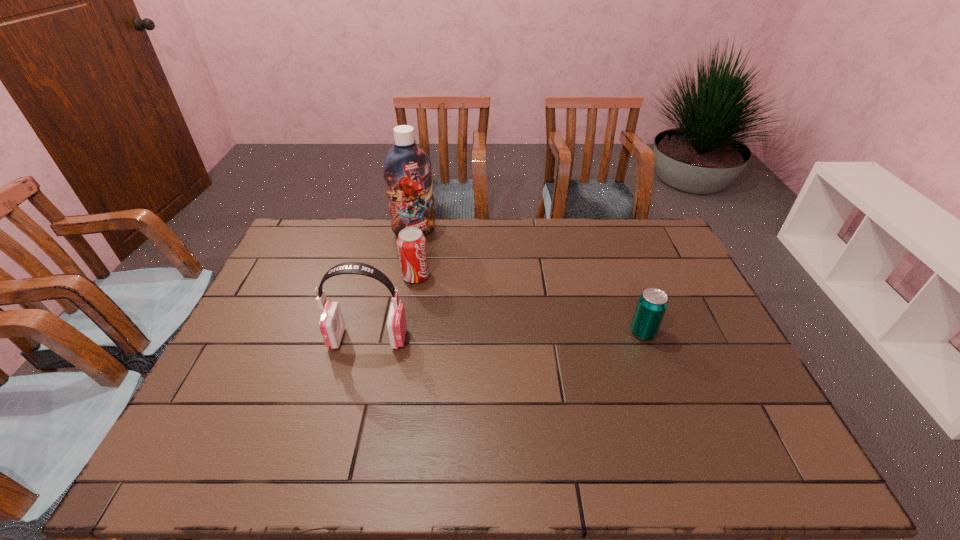
Where is `vacant area situated on the left of the beer can`? Image resolution: width=960 pixels, height=540 pixels. vacant area situated on the left of the beer can is located at coordinates (500, 333).

Image resolution: width=960 pixels, height=540 pixels. In order to click on free space located on the front label of the farthest object in this screenshot , I will do `click(457, 281)`.

You are a GUI agent. You are given a task and a screenshot of the screen. Output one action in this format:
    pyautogui.click(x=<x>, y=<y>)
    Task: Click on the vacant region located on the front label of the farthest object
    This screenshot has width=960, height=540.
    Given the screenshot: What is the action you would take?
    pyautogui.click(x=439, y=258)

The height and width of the screenshot is (540, 960). I want to click on free region located 0.310m on the front label of the farthest object, so click(x=465, y=289).

Image resolution: width=960 pixels, height=540 pixels. I want to click on free space located 0.310m on the logo side of the third tallest object, so click(x=502, y=327).

Locate an element on the screen. Image resolution: width=960 pixels, height=540 pixels. free space located on the logo side of the third tallest object is located at coordinates (494, 322).

Image resolution: width=960 pixels, height=540 pixels. What are the coordinates of `blank area located on the logo side of the third tallest object` in the screenshot? It's located at [x=446, y=294].

Where is `object that is at the far edge`? This screenshot has width=960, height=540. object that is at the far edge is located at coordinates (407, 168).

Locate an element on the screen. The height and width of the screenshot is (540, 960). free space at the far edge of the desktop is located at coordinates (x=586, y=241).

The height and width of the screenshot is (540, 960). In the image, there is a desktop. What are the coordinates of `blank space at the near edge` in the screenshot? It's located at (510, 404).